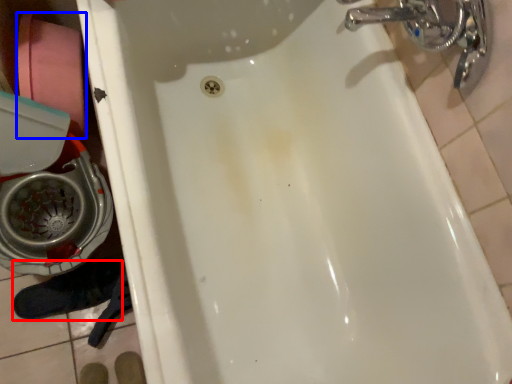
Question: Among these objects, which one is nearest to the camera, shoe (highlighted by a red box) or toilet paper (highlighted by a blue box)?

Choices:
 (A) shoe
 (B) toilet paper

Answer: (B)